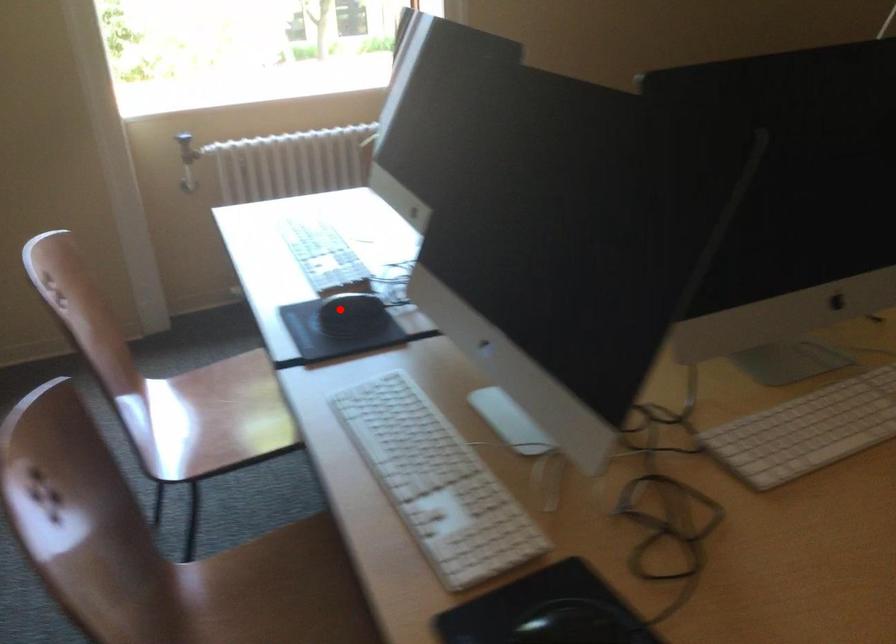
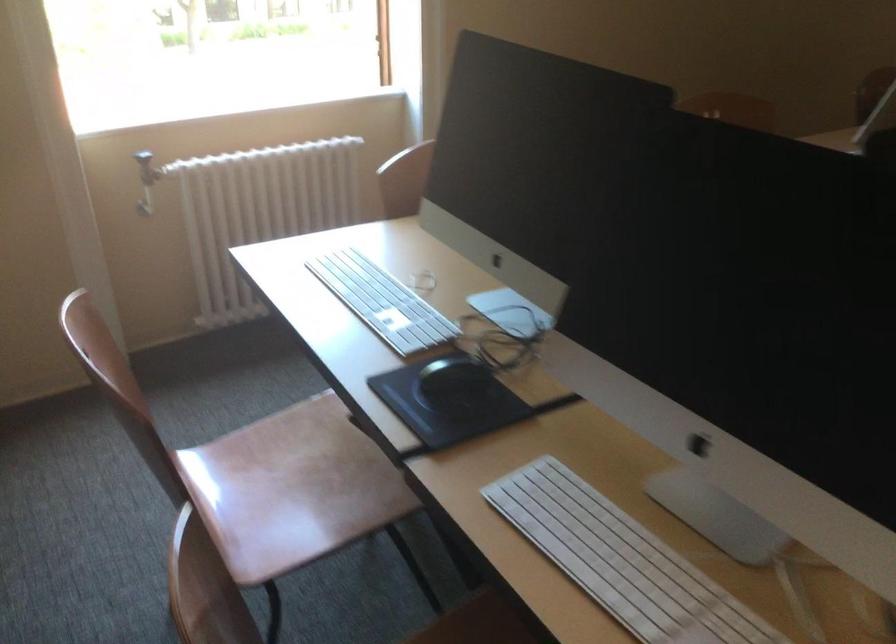
Question: A red point is marked in image1. In image2, is the corresponding 3D point closer to the camera or farther? Reply with the corresponding letter.

Choices:
 (A) The corresponding 3D point is closer.
 (B) The corresponding 3D point is farther.

Answer: (A)